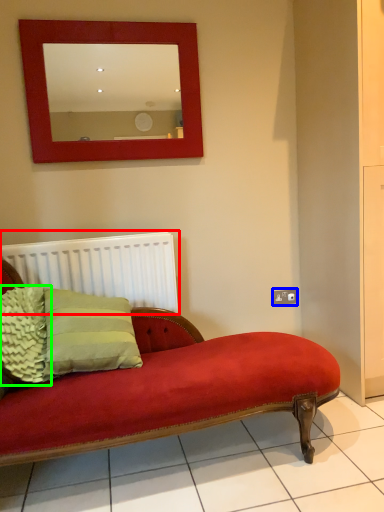
Question: Which is nearer to the radiator (highlighted by a red box)? electric outlet (highlighted by a blue box) or pillow (highlighted by a green box).

Choices:
 (A) electric outlet
 (B) pillow

Answer: (B)